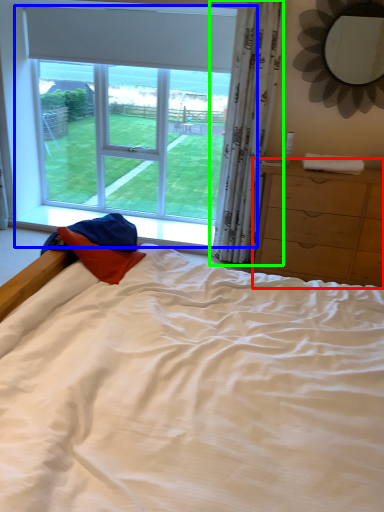
Question: Which object is the farthest from chest of drawers (highlighted by a red box)? Choose among these: window (highlighted by a blue box) or curtain (highlighted by a green box).

Choices:
 (A) window
 (B) curtain

Answer: (A)